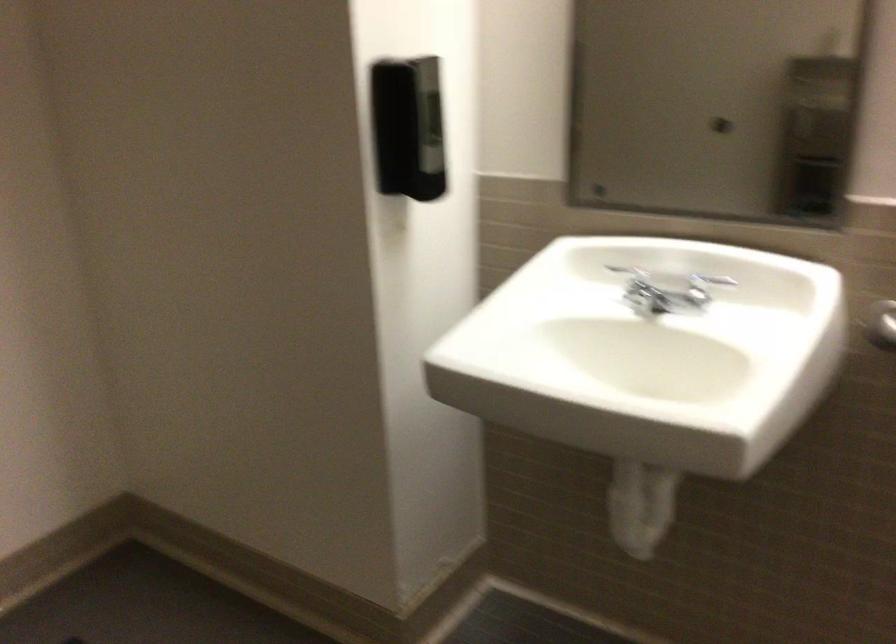
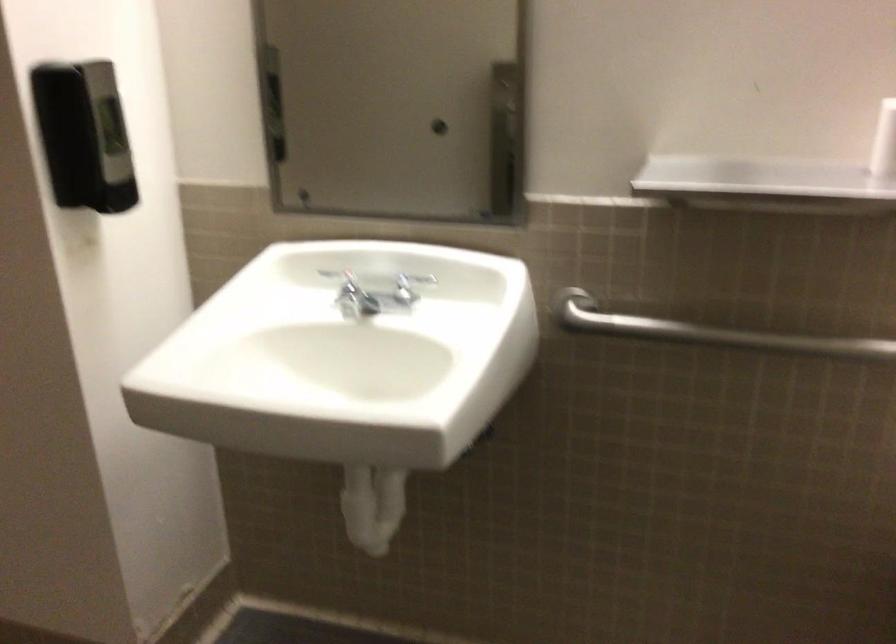
Question: The first image is from the beginning of the video and the second image is from the end. How did the camera likely rotate when shooting the video?

Choices:
 (A) Left
 (B) Right
 (C) Up
 (D) Down

Answer: (B)